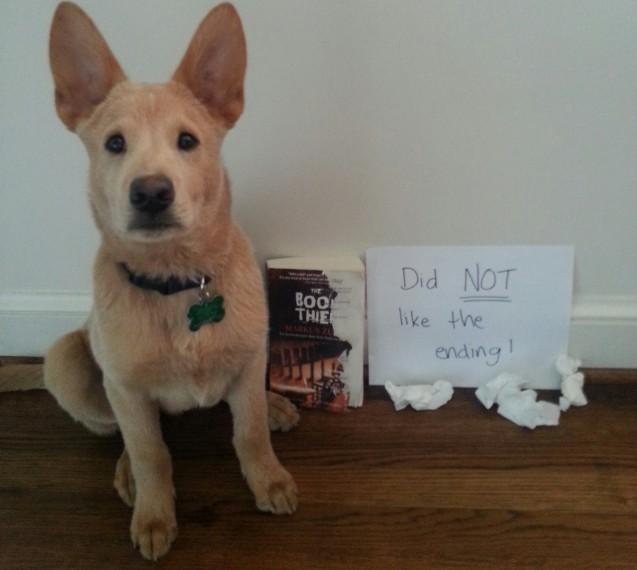
Where is `wall`? The height and width of the screenshot is (570, 637). wall is located at coordinates (399, 81).